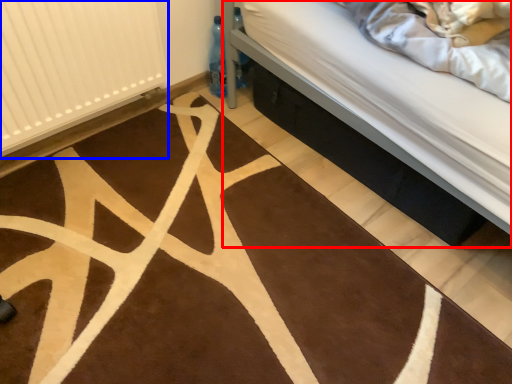
Question: Which point is further to the camera, bed (highlighted by a red box) or radiator (highlighted by a blue box)?

Choices:
 (A) bed
 (B) radiator

Answer: (A)